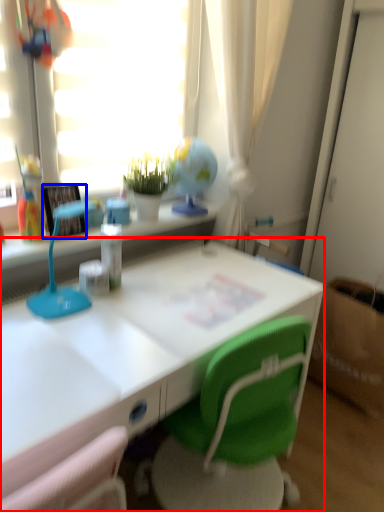
Question: Which object appears closest to the camera in this image, desk (highlighted by a red box) or picture frame (highlighted by a blue box)?

Choices:
 (A) desk
 (B) picture frame

Answer: (A)